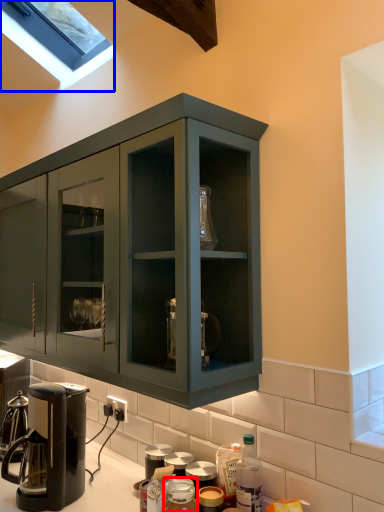
Question: Which object is closer to the camera taking this photo, bottle (highlighted by a red box) or window (highlighted by a blue box)?

Choices:
 (A) bottle
 (B) window

Answer: (A)